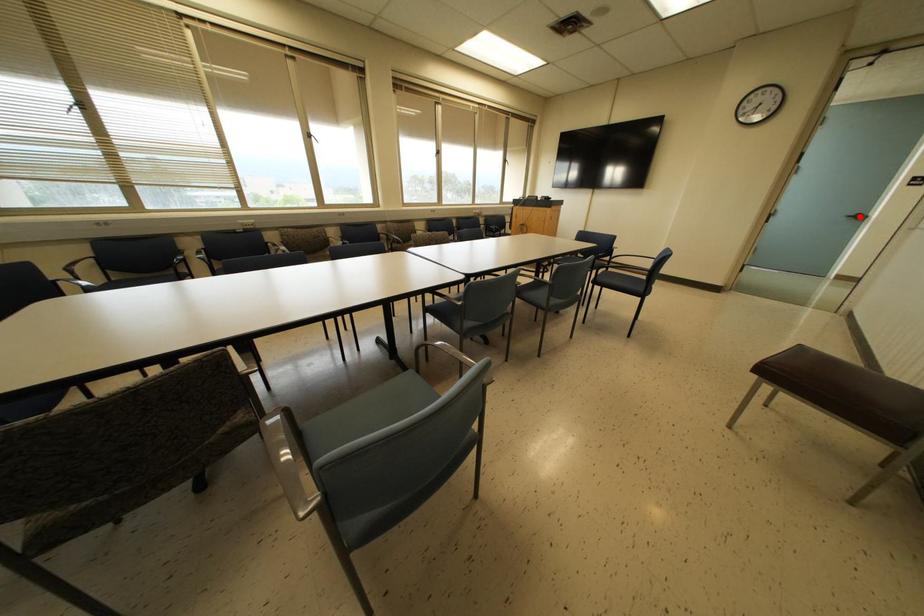
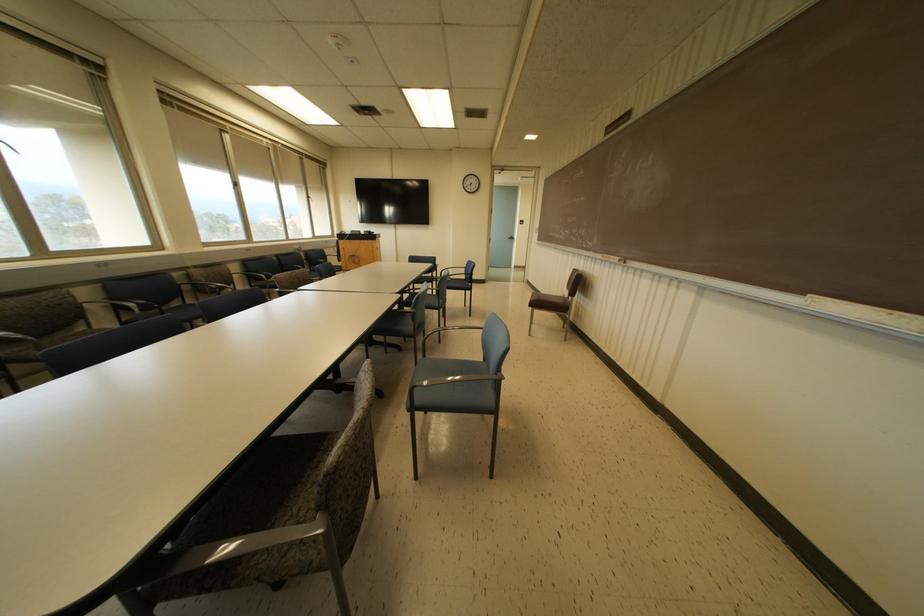
In the second image, find the point that corresponds to the highlighted location in the first image.

(512, 238)